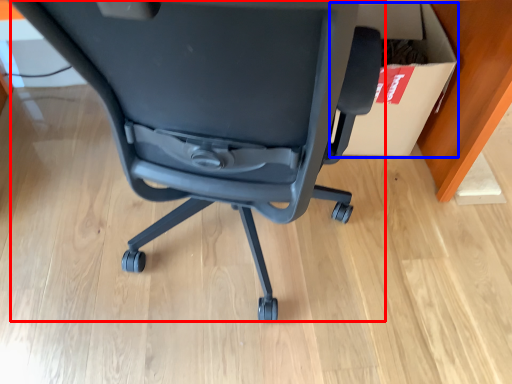
Question: Among these objects, which one is nearest to the camera, chair (highlighted by a red box) or cardboard box (highlighted by a blue box)?

Choices:
 (A) chair
 (B) cardboard box

Answer: (A)